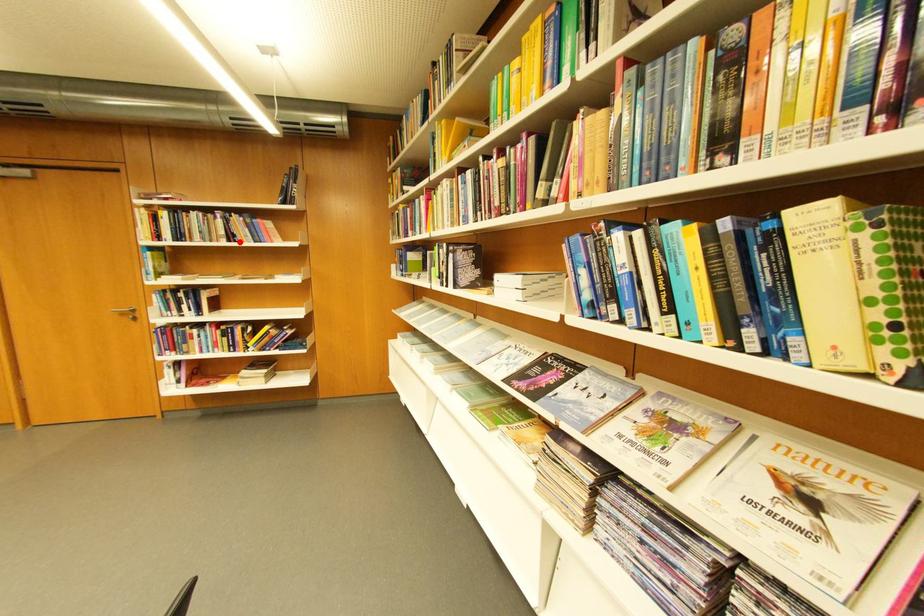
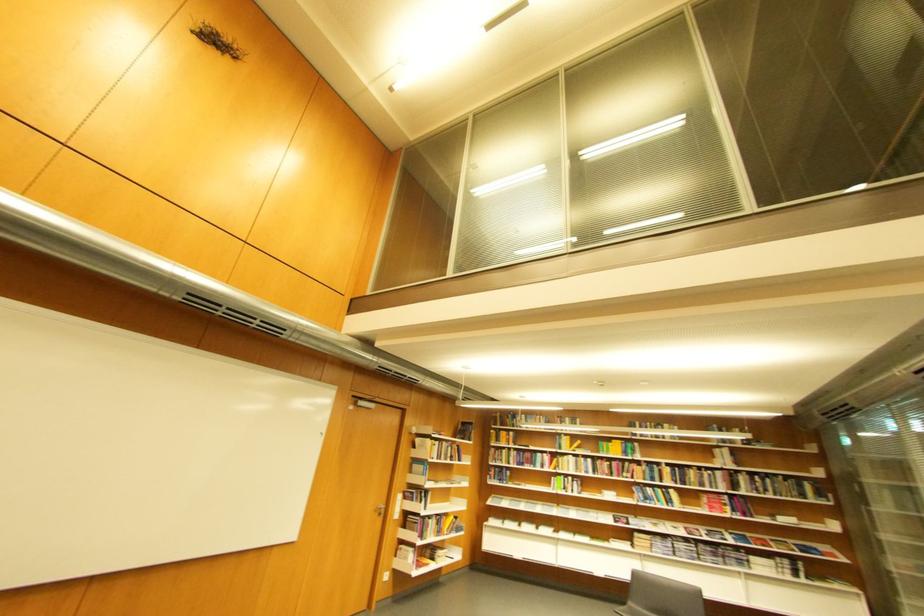
Where in the second image is the point corresponding to the highlighted location from the first image?

(460, 461)